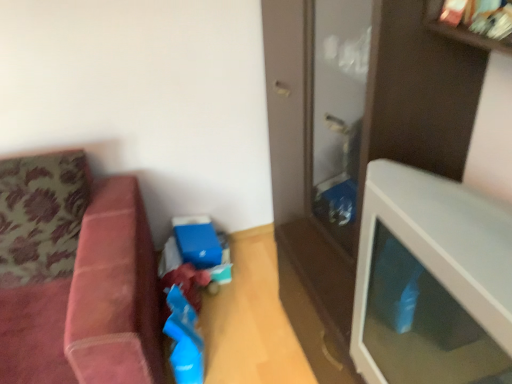
Question: From a real-world perspective, is white glossy table at right over velvet pink couch at left?

Choices:
 (A) no
 (B) yes

Answer: (B)

Question: Is the depth of white glossy table at right greater than that of velvet pink couch at left?

Choices:
 (A) yes
 (B) no

Answer: (B)

Question: From the image's perspective, does white glossy table at right appear lower than velvet pink couch at left?

Choices:
 (A) no
 (B) yes

Answer: (A)

Question: Can you confirm if white glossy table at right is thinner than velvet pink couch at left?

Choices:
 (A) yes
 (B) no

Answer: (A)

Question: Is white glossy table at right wider than velvet pink couch at left?

Choices:
 (A) yes
 (B) no

Answer: (B)

Question: Considering the relative sizes of white glossy table at right and velvet pink couch at left in the image provided, is white glossy table at right shorter than velvet pink couch at left?

Choices:
 (A) no
 (B) yes

Answer: (B)

Question: Is velvet pink couch at left positioned before white glossy table at right?

Choices:
 (A) yes
 (B) no

Answer: (B)

Question: From a real-world perspective, is velvet pink couch at left physically below white glossy table at right?

Choices:
 (A) no
 (B) yes

Answer: (B)

Question: From a real-world perspective, is velvet pink couch at left on top of white glossy table at right?

Choices:
 (A) yes
 (B) no

Answer: (B)

Question: Considering the relative sizes of velvet pink couch at left and white glossy table at right in the image provided, is velvet pink couch at left taller than white glossy table at right?

Choices:
 (A) yes
 (B) no

Answer: (A)

Question: From the image's perspective, would you say velvet pink couch at left is positioned over white glossy table at right?

Choices:
 (A) no
 (B) yes

Answer: (A)

Question: Are velvet pink couch at left and white glossy table at right located far from each other?

Choices:
 (A) no
 (B) yes

Answer: (A)

Question: Is velvet pink couch at left spatially inside white glossy table at right, or outside of it?

Choices:
 (A) inside
 (B) outside

Answer: (B)